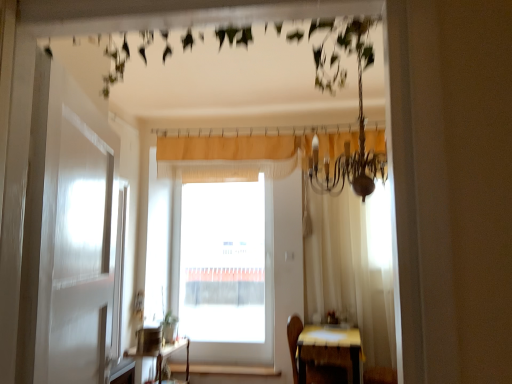
Locate an element on the screen. free point above beige textured curtain at center (from a real-world perspective) is located at coordinates (250, 132).